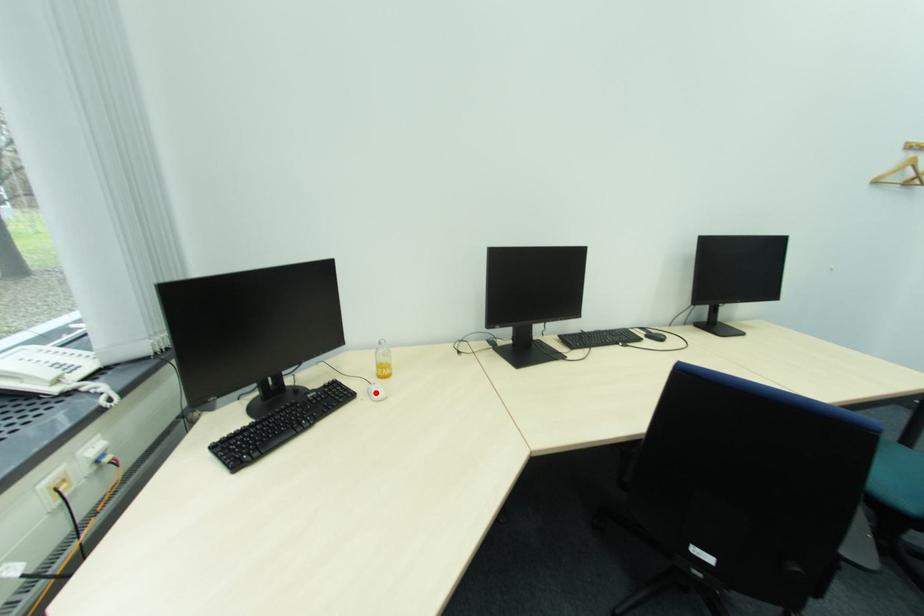
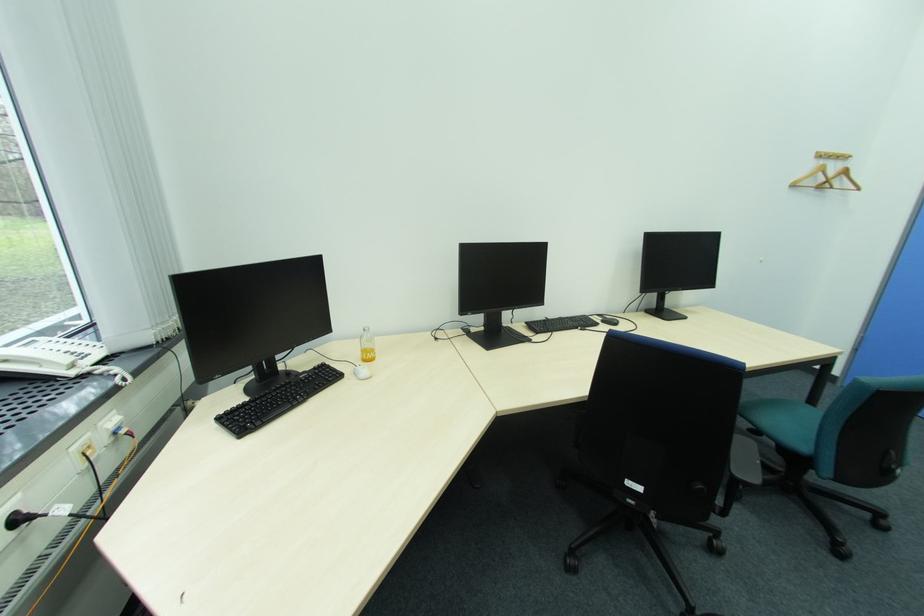
The point at the highlighted location is marked in the first image. Where is the corresponding point in the second image?

(361, 374)